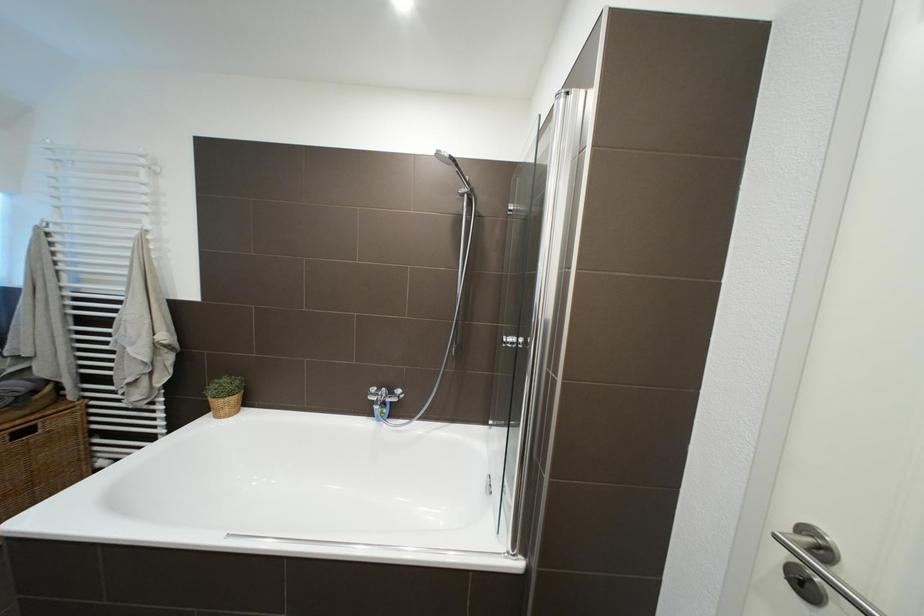
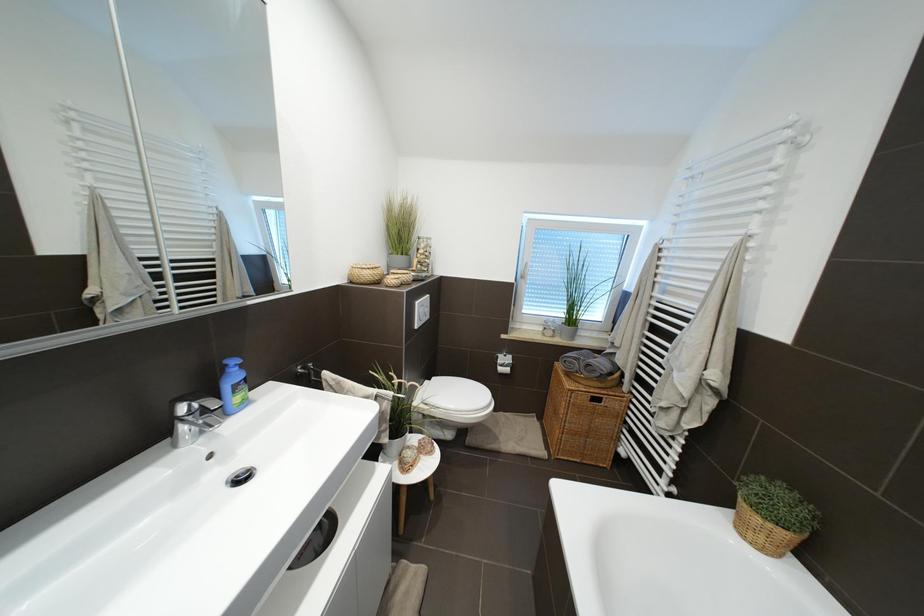
Question: The first image is from the beginning of the video and the second image is from the end. How did the camera likely rotate when shooting the video?

Choices:
 (A) Left
 (B) Right
 (C) Up
 (D) Down

Answer: (A)